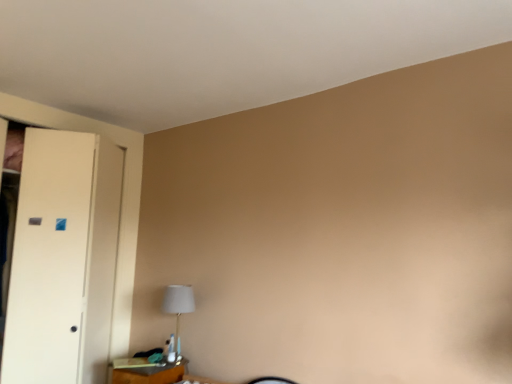
Measure the distance between matte white lampshade at lower left and camera.

matte white lampshade at lower left is 2.88 meters from camera.

Locate an element on the screen. The height and width of the screenshot is (384, 512). matte white lampshade at lower left is located at coordinates (178, 304).

This screenshot has height=384, width=512. What do you see at coordinates (178, 304) in the screenshot? I see `matte white lampshade at lower left` at bounding box center [178, 304].

The width and height of the screenshot is (512, 384). What are the coordinates of `matte white lampshade at lower left` in the screenshot? It's located at (178, 304).